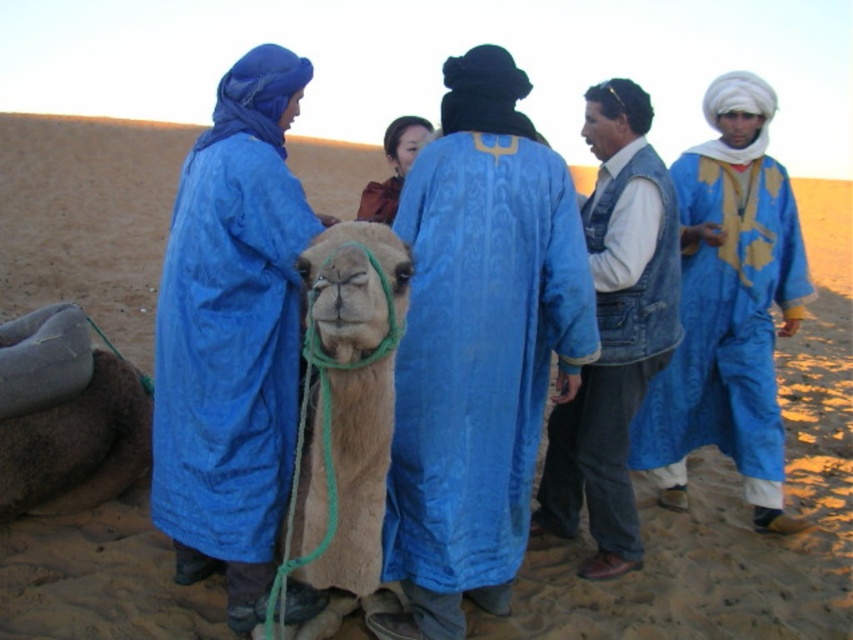
Question: Is matte blue robe at left positioned behind denim vest at center?

Choices:
 (A) yes
 (B) no

Answer: (B)

Question: Which point is closer to the camera taking this photo?

Choices:
 (A) (387, 145)
 (B) (401, 464)

Answer: (B)

Question: Can you confirm if velvet blue robe at center is wider than fuzzy beige camel at center?

Choices:
 (A) yes
 (B) no

Answer: (A)

Question: Which object is closer to the camera taking this photo?

Choices:
 (A) burgundy fabric bag at center
 (B) denim vest at center

Answer: (B)

Question: Which of the following is the closest to the observer?

Choices:
 (A) matte blue robe at left
 (B) velvet blue robe at center

Answer: (B)

Question: Does fuzzy beige camel at center have a lesser width compared to burgundy fabric bag at center?

Choices:
 (A) no
 (B) yes

Answer: (A)